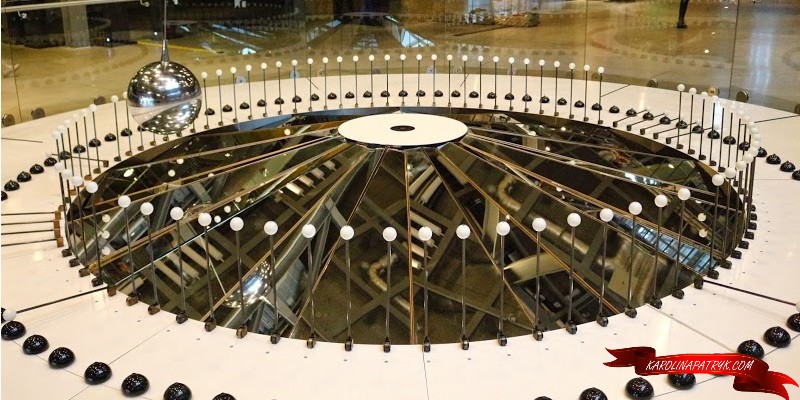
The width and height of the screenshot is (800, 400). I want to click on circle of lights, so click(506, 229).